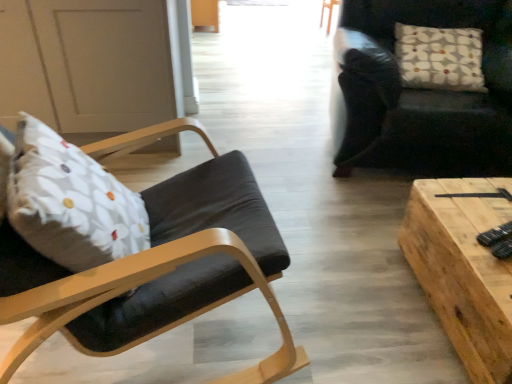
The height and width of the screenshot is (384, 512). Describe the element at coordinates (463, 270) in the screenshot. I see `wooden plank table at center` at that location.

The image size is (512, 384). I want to click on matte black chair at left, the 2th chair when ordered from right to left, so click(138, 252).

You are a GUI agent. You are given a task and a screenshot of the screen. Output one action in this format:
    pyautogui.click(x=<x>, y=<y>)
    Task: Click on the dark leather chair at upper right, arranged as the 1th chair when viewed from the right
    This screenshot has width=512, height=384.
    Given the screenshot: What is the action you would take?
    pyautogui.click(x=420, y=93)

The image size is (512, 384). What are the coordinates of `chair on the left of black plastic remote control at lower right` in the screenshot? It's located at (138, 252).

Could you measure the distance between matte black chair at left, the first chair viewed from the left, and black plastic remote control at lower right?

matte black chair at left, the first chair viewed from the left, is 38.72 inches from black plastic remote control at lower right.

Is matte black chair at left, the 1th chair in the front-to-back sequence, at the left side of black plastic remote control at lower right?

Yes, matte black chair at left, the 1th chair in the front-to-back sequence, is to the left of black plastic remote control at lower right.

Does matte black chair at left, the 2th chair when ordered from right to left, have a greater height compared to black plastic remote control at lower right?

Yes.

Are white floral fabric pillow at upper right and matte black chair at left, the 2th chair when ordered from back to front, far apart?

white floral fabric pillow at upper right is far away from matte black chair at left, the 2th chair when ordered from back to front.

Would you say matte black chair at left, the first chair viewed from the left, is part of white floral fabric pillow at upper right's contents?

No, white floral fabric pillow at upper right does not contain matte black chair at left, the first chair viewed from the left.

Does point (395, 51) come farther from viewer compared to point (18, 229)?

Yes, it is behind point (18, 229).

Could you tell me if white floral fabric pillow at upper right is turned towards matte black chair at left, the 1th chair in the front-to-back sequence?

No, white floral fabric pillow at upper right is not oriented towards matte black chair at left, the 1th chair in the front-to-back sequence.

Does point (489, 244) lie behind point (41, 291)?

Yes.

From a real-world perspective, who is located lower, black plastic remote control at lower right or matte black chair at left, the 1th chair in the front-to-back sequence?

black plastic remote control at lower right, from a real-world perspective.

From the image's perspective, is black plastic remote control at lower right located above matte black chair at left, the 2th chair when ordered from back to front?

No, from the image's perspective, black plastic remote control at lower right is not over matte black chair at left, the 2th chair when ordered from back to front.

Can you confirm if black plastic remote control at lower right is taller than matte black chair at left, the 1th chair in the front-to-back sequence?

No.

Considering the sizes of objects matte black chair at left, the 2th chair when ordered from right to left, and wooden plank table at center in the image provided, who is bigger, matte black chair at left, the 2th chair when ordered from right to left, or wooden plank table at center?

matte black chair at left, the 2th chair when ordered from right to left.

Considering the positions of objects matte black chair at left, the 2th chair when ordered from back to front, and wooden plank table at center in the image provided, who is in front, matte black chair at left, the 2th chair when ordered from back to front, or wooden plank table at center?

Positioned in front is matte black chair at left, the 2th chair when ordered from back to front.

Are matte black chair at left, the 2th chair when ordered from right to left, and wooden plank table at center located far from each other?

No, there isn't a large distance between matte black chair at left, the 2th chair when ordered from right to left, and wooden plank table at center.

From the image's perspective, is matte black chair at left, the first chair viewed from the left, over wooden plank table at center?

Yes, from the image's perspective, matte black chair at left, the first chair viewed from the left, is on top of wooden plank table at center.

Is dark leather chair at upper right, the 1th chair from the back, positioned beyond the bounds of black plastic remote control at lower right?

Indeed, dark leather chair at upper right, the 1th chair from the back, is completely outside black plastic remote control at lower right.

Consider the image. Would you consider dark leather chair at upper right, the second chair positioned from the front, to be distant from black plastic remote control at lower right?

Yes.

In the image, there is a dark leather chair at upper right, the second chair positioned from the front. At what (x,y) coordinates should I click in order to perform the action: click on remote control below it (from a real-world perspective). Please return your answer as a coordinate pair (x, y). Image resolution: width=512 pixels, height=384 pixels. Looking at the image, I should click on (495, 235).

Between dark leather chair at upper right, the 1th chair from the back, and black plastic remote control at lower right, which one has smaller width?

With smaller width is black plastic remote control at lower right.

Between white floral fabric pillow at upper right and dark leather chair at upper right, arranged as the 1th chair when viewed from the right, which one has more height?

dark leather chair at upper right, arranged as the 1th chair when viewed from the right.

Could you tell me if white floral fabric pillow at upper right is turned towards dark leather chair at upper right, the 1th chair from the back?

Yes, white floral fabric pillow at upper right is aimed at dark leather chair at upper right, the 1th chair from the back.

In the scene shown: Is white floral fabric pillow at upper right spatially inside dark leather chair at upper right, arranged as the 1th chair when viewed from the right, or outside of it?

white floral fabric pillow at upper right is inside dark leather chair at upper right, arranged as the 1th chair when viewed from the right.

Considering the sizes of white floral fabric pillow at upper right and dark leather chair at upper right, the 1th chair from the back, in the image, is white floral fabric pillow at upper right wider or thinner than dark leather chair at upper right, the 1th chair from the back,?

In the image, white floral fabric pillow at upper right appears to be more narrow than dark leather chair at upper right, the 1th chair from the back.

Which point is more forward, (493, 26) or (142, 292)?

Positioned in front is point (142, 292).

From a real-world perspective, is dark leather chair at upper right, arranged as the 1th chair when viewed from the right, physically located above or below matte black chair at left, the first chair viewed from the left?

dark leather chair at upper right, arranged as the 1th chair when viewed from the right, is below matte black chair at left, the first chair viewed from the left.

Can you tell me how much dark leather chair at upper right, which ranks as the second chair in left-to-right order, and matte black chair at left, the first chair viewed from the left, differ in facing direction?

The facing directions of dark leather chair at upper right, which ranks as the second chair in left-to-right order, and matte black chair at left, the first chair viewed from the left, are 110 degrees apart.

Is dark leather chair at upper right, which ranks as the second chair in left-to-right order, inside or outside of matte black chair at left, the first chair viewed from the left?

dark leather chair at upper right, which ranks as the second chair in left-to-right order, is not enclosed by matte black chair at left, the first chair viewed from the left.

Where is `chair that is on the left side of black plastic remote control at lower right`? This screenshot has height=384, width=512. chair that is on the left side of black plastic remote control at lower right is located at coordinates (138, 252).

At what (x,y) coordinates should I click in order to perform the action: click on the 2nd chair in front of the white floral fabric pillow at upper right. Please return your answer as a coordinate pair (x, y). Image resolution: width=512 pixels, height=384 pixels. Looking at the image, I should click on (138, 252).

Based on their spatial positions, is dark leather chair at upper right, the second chair positioned from the front, or white floral fabric pillow at upper right closer to black plastic remote control at lower right?

Based on the image, dark leather chair at upper right, the second chair positioned from the front, appears to be nearer to black plastic remote control at lower right.

Estimate the real-world distances between objects in this image. Which object is further from wooden plank table at center, black plastic remote control at lower right or matte black chair at left, the 2th chair when ordered from back to front?

matte black chair at left, the 2th chair when ordered from back to front, lies further to wooden plank table at center than the other object.

When comparing their distances from matte black chair at left, the first chair viewed from the left, does white floral fabric pillow at upper right or wooden plank table at center seem further?

white floral fabric pillow at upper right is further to matte black chair at left, the first chair viewed from the left.

In the scene shown: Which object lies nearer to the anchor point black plastic remote control at lower right, wooden plank table at center or white floral fabric pillow at upper right?

wooden plank table at center is closer to black plastic remote control at lower right.

Which object lies further to the anchor point black plastic remote control at lower right, white floral fabric pillow at upper right or matte black chair at left, the 1th chair in the front-to-back sequence?

white floral fabric pillow at upper right lies further to black plastic remote control at lower right than the other object.

When comparing their distances from black plastic remote control at lower right, does dark leather chair at upper right, which ranks as the second chair in left-to-right order, or wooden plank table at center seem closer?

Based on the image, wooden plank table at center appears to be nearer to black plastic remote control at lower right.

Estimate the real-world distances between objects in this image. Which object is closer to black plastic remote control at lower right, matte black chair at left, the 2th chair when ordered from right to left, or wooden plank table at center?

Among the two, wooden plank table at center is located nearer to black plastic remote control at lower right.

Based on their spatial positions, is matte black chair at left, the first chair viewed from the left, or dark leather chair at upper right, arranged as the 1th chair when viewed from the right, further from white floral fabric pillow at upper right?

Based on the image, matte black chair at left, the first chair viewed from the left, appears to be further to white floral fabric pillow at upper right.

Identify the location of remote control between matte black chair at left, the 2th chair when ordered from back to front, and dark leather chair at upper right, arranged as the 1th chair when viewed from the right, in the horizontal direction. (495, 235).

The width and height of the screenshot is (512, 384). Find the location of `table situated between matte black chair at left, the first chair viewed from the left, and dark leather chair at upper right, which ranks as the second chair in left-to-right order, from left to right`. table situated between matte black chair at left, the first chair viewed from the left, and dark leather chair at upper right, which ranks as the second chair in left-to-right order, from left to right is located at coordinates (463, 270).

Locate an element on the screen. This screenshot has width=512, height=384. remote control between wooden plank table at center and white floral fabric pillow at upper right along the z-axis is located at coordinates (495, 235).

Find the location of a particular element. Image resolution: width=512 pixels, height=384 pixels. chair positioned between matte black chair at left, the 1th chair in the front-to-back sequence, and white floral fabric pillow at upper right from near to far is located at coordinates (420, 93).